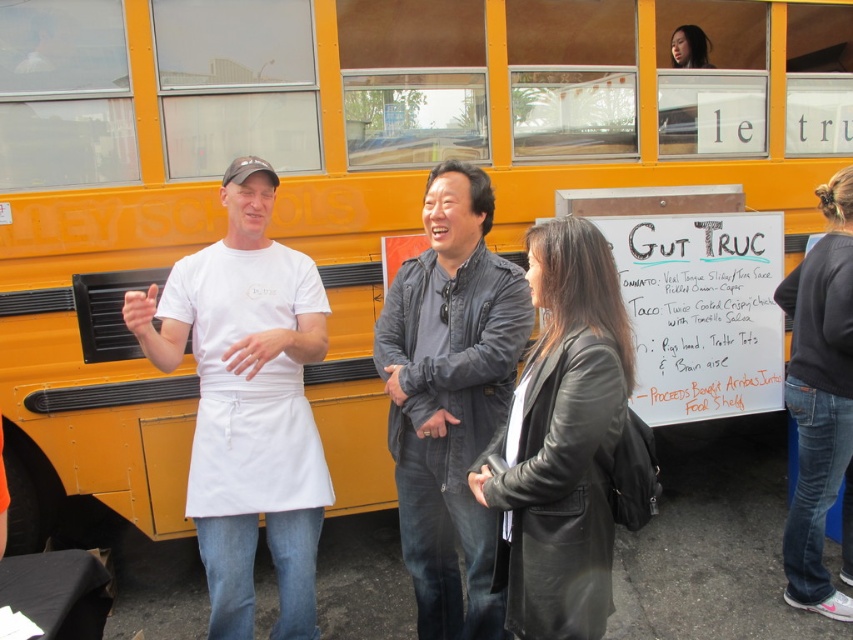
Question: Does dark gray leather jacket at center have a lesser width compared to dark gray sweater at lower right?

Choices:
 (A) yes
 (B) no

Answer: (B)

Question: Which point appears farthest from the camera in this image?

Choices:
 (A) (460, 513)
 (B) (223, 182)

Answer: (B)

Question: Which object appears farthest from the camera in this image?

Choices:
 (A) dark gray leather jacket at center
 (B) white matte apron at center
 (C) dark gray sweater at lower right

Answer: (C)

Question: From the image, what is the correct spatial relationship of dark gray leather jacket at center in relation to black leather jacket at center?

Choices:
 (A) right
 (B) left

Answer: (B)

Question: Where is white matte apron at center located in relation to black leather jacket at center in the image?

Choices:
 (A) left
 (B) right

Answer: (A)

Question: Estimate the real-world distances between objects in this image. Which object is closer to the black leather jacket at center?

Choices:
 (A) white matte apron at center
 (B) dark gray sweater at lower right

Answer: (A)